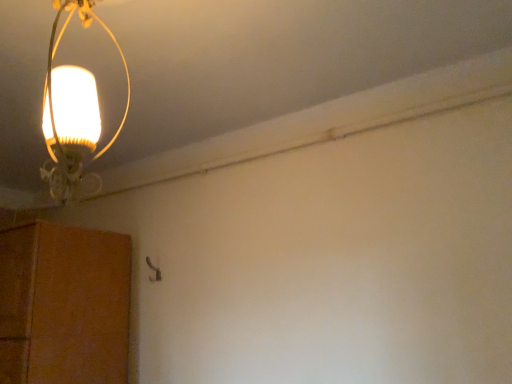
Question: Does brown textured cabinet at lower left appear on the right side of matte glass lamp at upper left?

Choices:
 (A) yes
 (B) no

Answer: (B)

Question: From a real-world perspective, is brown textured cabinet at lower left physically below matte glass lamp at upper left?

Choices:
 (A) yes
 (B) no

Answer: (A)

Question: Are brown textured cabinet at lower left and matte glass lamp at upper left beside each other?

Choices:
 (A) no
 (B) yes

Answer: (A)

Question: Is brown textured cabinet at lower left far away from matte glass lamp at upper left?

Choices:
 (A) no
 (B) yes

Answer: (A)

Question: Does brown textured cabinet at lower left have a lesser width compared to matte glass lamp at upper left?

Choices:
 (A) no
 (B) yes

Answer: (A)

Question: Is brown textured cabinet at lower left facing towards matte glass lamp at upper left?

Choices:
 (A) no
 (B) yes

Answer: (A)

Question: Is matte glass lamp at upper left positioned beyond the bounds of brown textured cabinet at lower left?

Choices:
 (A) yes
 (B) no

Answer: (A)

Question: Is matte glass lamp at upper left positioned before brown textured cabinet at lower left?

Choices:
 (A) yes
 (B) no

Answer: (A)

Question: From a real-world perspective, is matte glass lamp at upper left positioned under brown textured cabinet at lower left based on gravity?

Choices:
 (A) yes
 (B) no

Answer: (B)

Question: Does matte glass lamp at upper left have a lesser height compared to brown textured cabinet at lower left?

Choices:
 (A) no
 (B) yes

Answer: (B)

Question: Is matte glass lamp at upper left taller than brown textured cabinet at lower left?

Choices:
 (A) yes
 (B) no

Answer: (B)

Question: Can you confirm if matte glass lamp at upper left is positioned to the right of brown textured cabinet at lower left?

Choices:
 (A) yes
 (B) no

Answer: (A)

Question: In the image, is brown textured cabinet at lower left positioned in front of or behind matte glass lamp at upper left?

Choices:
 (A) behind
 (B) front

Answer: (A)